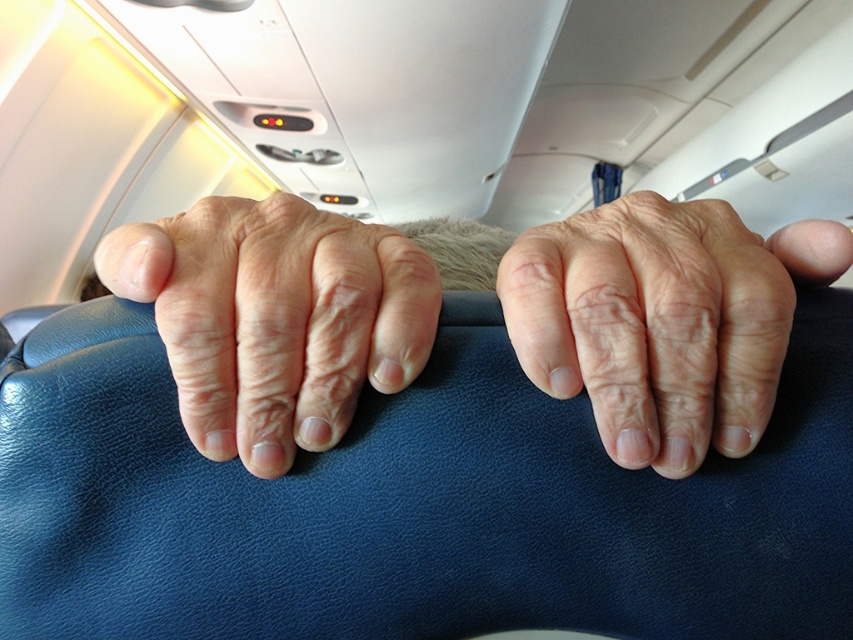
Question: Which object appears farthest from the camera in this image?

Choices:
 (A) dry skin hand at center
 (B) dry skin at center
 (C) leather-like hands at center

Answer: (A)

Question: Is dry skin at center bigger than dry skin hand at center?

Choices:
 (A) yes
 (B) no

Answer: (A)

Question: Which object is the closest to the dry skin hand at center?

Choices:
 (A) leather-like hands at center
 (B) dry skin at center

Answer: (A)

Question: Which of these objects is positioned closest to the dry skin hand at center?

Choices:
 (A) leather-like hands at center
 (B) dry skin at center

Answer: (A)

Question: Does leather-like hands at center appear on the left side of dry skin hand at center?

Choices:
 (A) yes
 (B) no

Answer: (B)

Question: Can you confirm if dry skin at center is wider than dry skin hand at center?

Choices:
 (A) no
 (B) yes

Answer: (B)